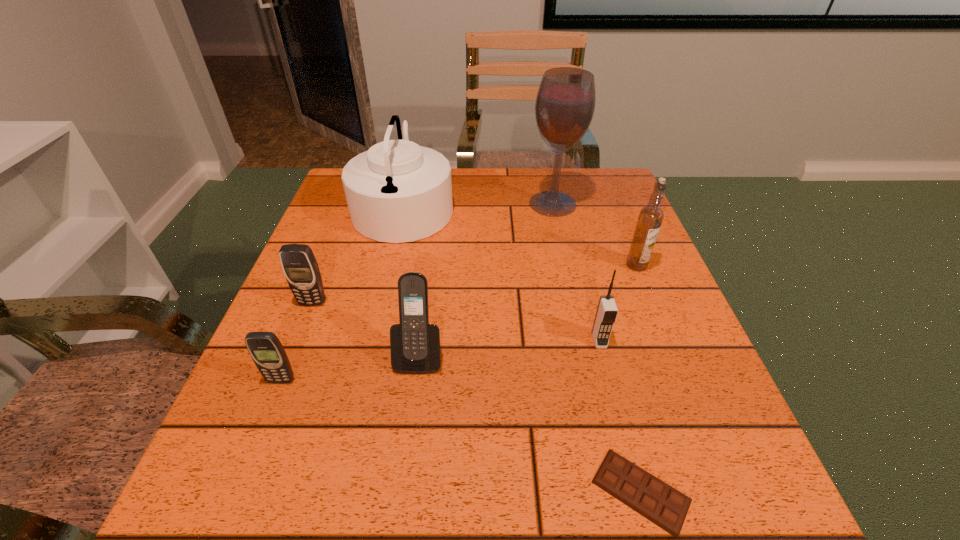
Identify the location of vacant region at the near edge of the desktop. (537, 522).

I want to click on free space at the left edge, so click(232, 420).

In order to click on blank space at the right edge of the desktop in this screenshot , I will do `click(648, 280)`.

Identify the location of vacant space at the far left corner of the desktop. The width and height of the screenshot is (960, 540). (332, 193).

At what (x,y) coordinates should I click in order to perform the action: click on free space at the far right corner of the desktop. Please return your answer as a coordinate pair (x, y). The width and height of the screenshot is (960, 540). Looking at the image, I should click on (584, 168).

The width and height of the screenshot is (960, 540). I want to click on free point between the second cellular telephone from right to left and the vodka, so click(x=528, y=310).

Identify the location of vacant space that's between the second nearest object and the second cellular telephone from right to left. tap(350, 368).

This screenshot has height=540, width=960. Find the location of `vacant area that lies between the rightmost cellular telephone and the kettle`. vacant area that lies between the rightmost cellular telephone and the kettle is located at coordinates (502, 274).

Identify the location of vacant area that lies between the rightmost object and the second cellular telephone from right to left. (528, 310).

This screenshot has height=540, width=960. I want to click on empty space between the third cellular telephone from left to right and the rightmost object, so click(528, 310).